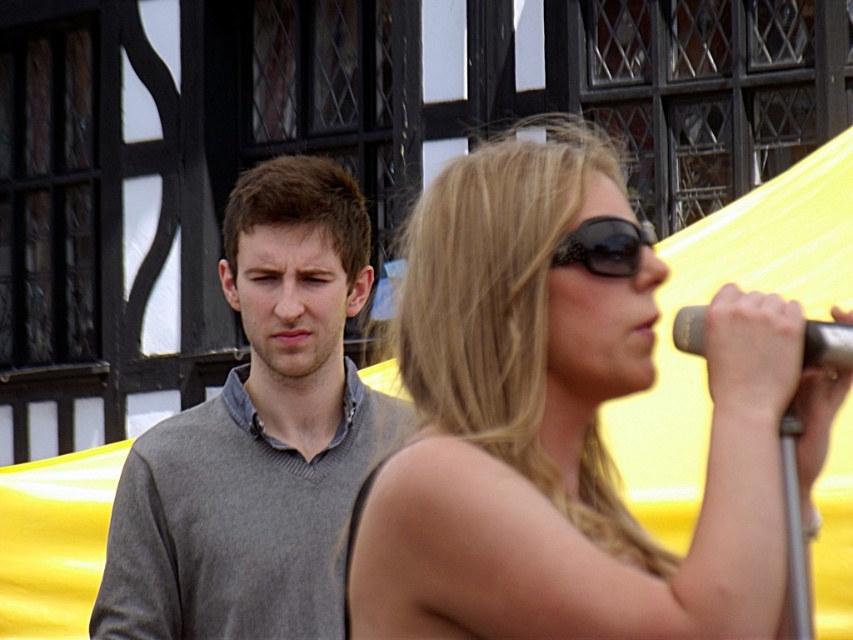
Question: In this image, where is shiny black sunglasses at center located relative to gray wool sweater at left?

Choices:
 (A) left
 (B) right

Answer: (B)

Question: Does gray wool sweater at left have a smaller size compared to black reflective sunglasses at upper right?

Choices:
 (A) no
 (B) yes

Answer: (A)

Question: Among these points, which one is nearest to the camera?

Choices:
 (A) (595, 253)
 (B) (840, 362)

Answer: (B)

Question: Is black reflective sunglasses at upper right positioned in front of metallic silver microphone at right?

Choices:
 (A) yes
 (B) no

Answer: (B)

Question: Which object is the farthest from the black reflective sunglasses at upper right?

Choices:
 (A) gray wool sweater at left
 (B) metallic silver microphone at right
 (C) shiny black sunglasses at center

Answer: (A)

Question: Considering the real-world distances, which object is closest to the metallic silver microphone at right?

Choices:
 (A) black reflective sunglasses at upper right
 (B) shiny black sunglasses at center

Answer: (B)